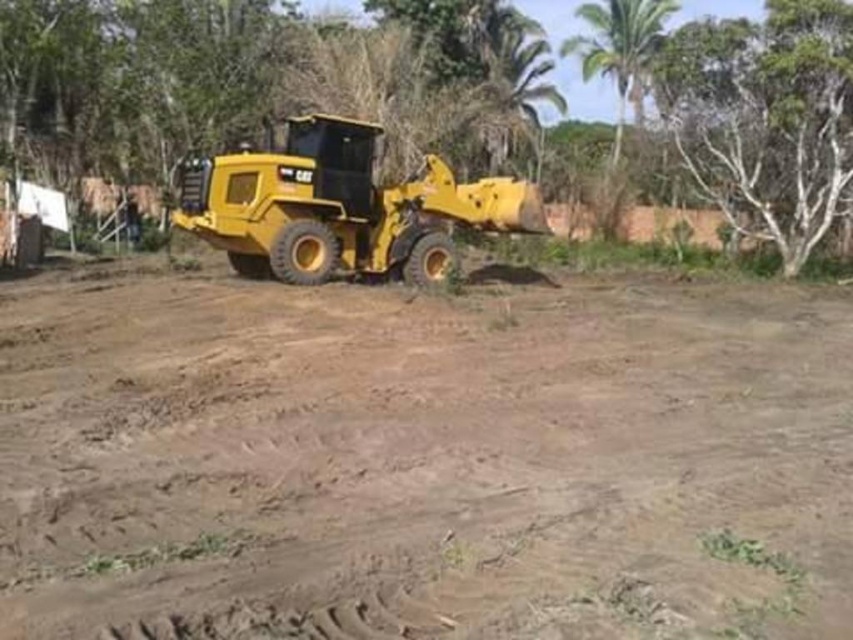
You are a construction worker standing at the yellow Caterpillar wheel loader in the center. You need to move the loader to the right side of the white smooth tree at upper right. Which direction should you turn to first to avoid the green leafy tree at upper center?

The green leafy tree at upper center is to the left of the white smooth tree at upper right. To avoid the green leafy tree at upper center, you should turn to the right first when moving towards the white smooth tree at upper right.

You are a construction worker who needs to determine which tree is taller between the green leafy tree at upper center and the white smooth tree at upper right. Based on the scene provided, which one is taller?

The green leafy tree at upper center is taller than the white smooth tree at upper right.

What are the coordinates of the brown sandy dirt at center?

The coordinates of the brown sandy dirt at center are at point [421,452].